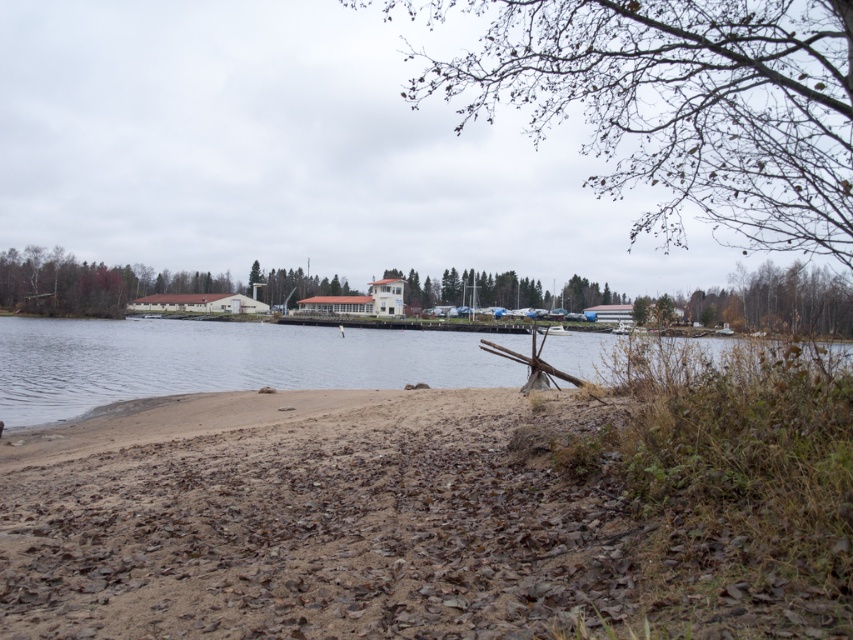
Between bare branches at upper center and clear water at center, which one is positioned higher?

bare branches at upper center is higher up.

This screenshot has width=853, height=640. What do you see at coordinates (682, 104) in the screenshot?
I see `bare branches at upper center` at bounding box center [682, 104].

The width and height of the screenshot is (853, 640). What are the coordinates of `bare branches at upper center` in the screenshot? It's located at (682, 104).

Does brown sandy beach at lower left lie in front of clear water at center?

Yes, brown sandy beach at lower left is in front of clear water at center.

Who is shorter, brown sandy beach at lower left or clear water at center?

brown sandy beach at lower left

This screenshot has height=640, width=853. Identify the location of brown sandy beach at lower left. (311, 518).

Is brown sandy beach at lower left below brown textured tree at upper right?

Indeed, brown sandy beach at lower left is positioned under brown textured tree at upper right.

Between brown sandy beach at lower left and brown textured tree at upper right, which one appears on the left side from the viewer's perspective?

brown sandy beach at lower left is more to the left.

The height and width of the screenshot is (640, 853). Find the location of `brown sandy beach at lower left`. brown sandy beach at lower left is located at coordinates (311, 518).